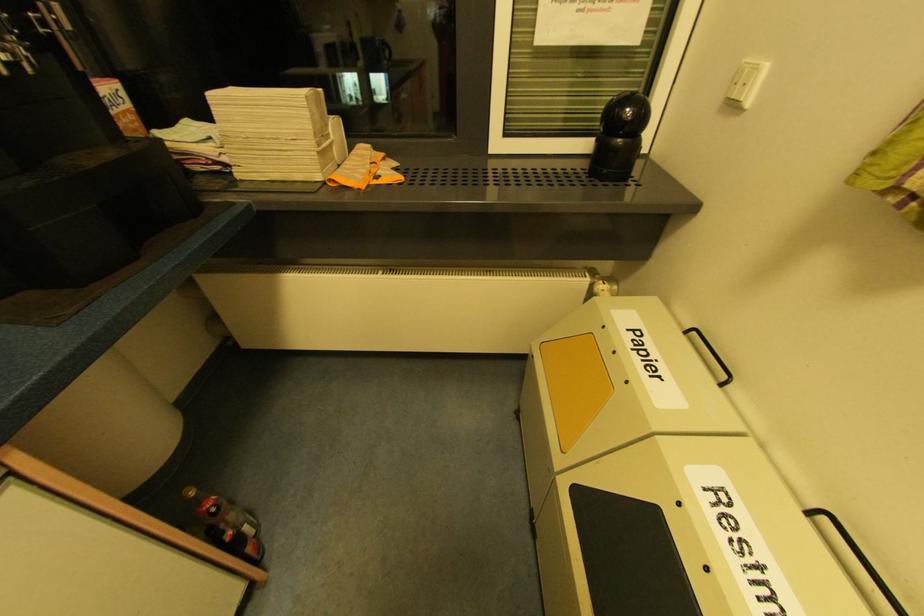
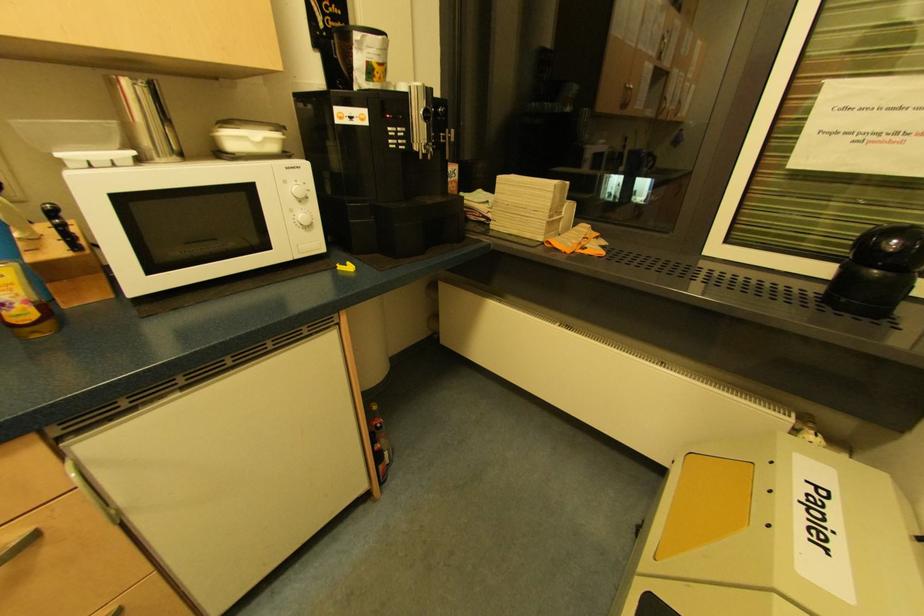
In the second image, find the point that corresponds to (x=198, y=493) in the first image.

(378, 410)